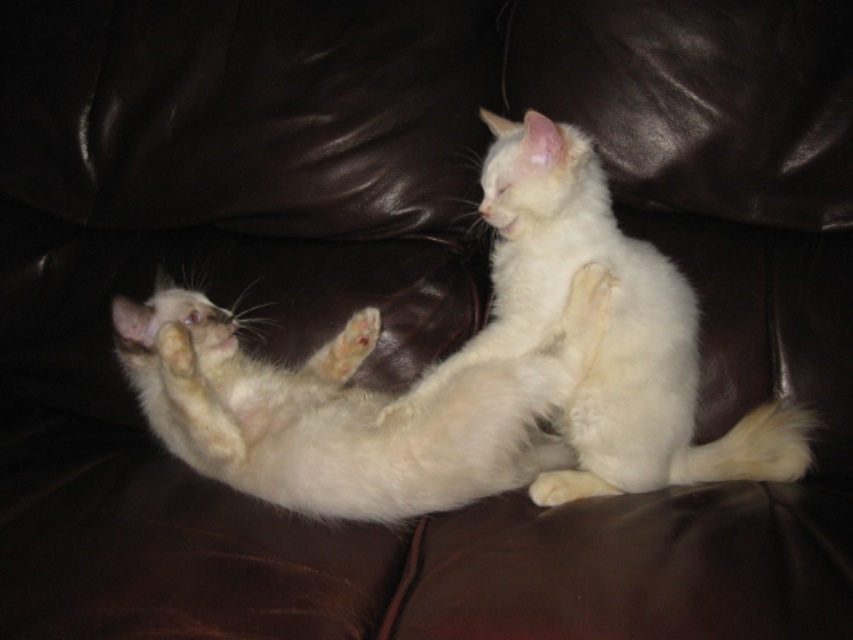
Question: Can you confirm if white fluffy cat at center is positioned to the left of white fluffy cat at upper right?

Choices:
 (A) no
 (B) yes

Answer: (B)

Question: Is white fluffy cat at center to the right of white fluffy cat at upper right from the viewer's perspective?

Choices:
 (A) yes
 (B) no

Answer: (B)

Question: Among these objects, which one is farthest from the camera?

Choices:
 (A) white fluffy cat at center
 (B) white fluffy cat at upper right

Answer: (B)

Question: Which of the following is the farthest from the observer?

Choices:
 (A) (190, 461)
 (B) (550, 260)

Answer: (A)

Question: Among these points, which one is nearest to the camera?

Choices:
 (A) (160, 342)
 (B) (582, 132)
 (C) (125, 342)

Answer: (A)

Question: From the image, what is the correct spatial relationship of white fluffy cat at upper right in relation to white fur paw at center?

Choices:
 (A) right
 (B) left

Answer: (A)